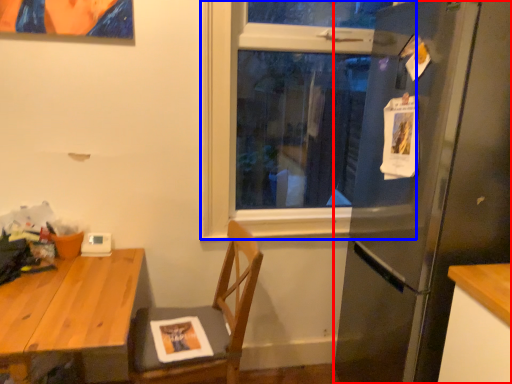
Question: Among these objects, which one is nearest to the camera, refrigerator (highlighted by a red box) or window (highlighted by a blue box)?

Choices:
 (A) refrigerator
 (B) window

Answer: (A)